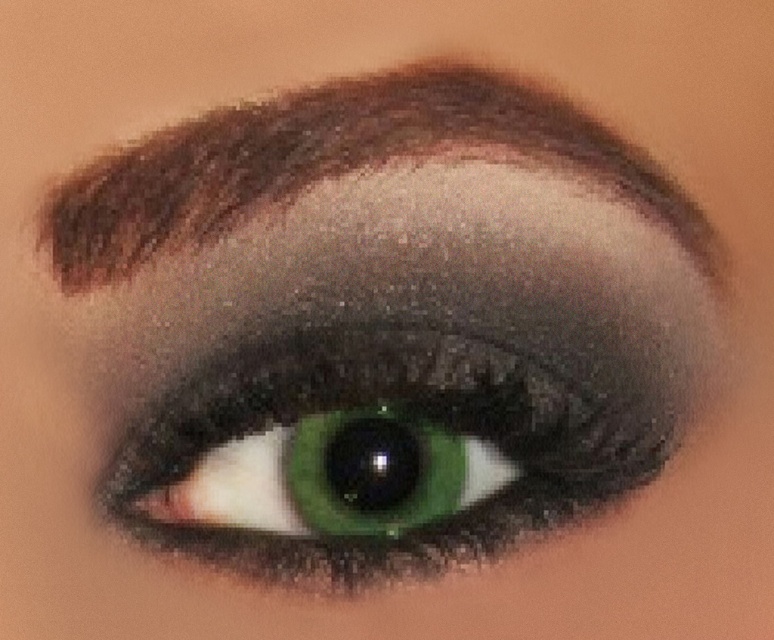
You are an artist analyzing a makeup look. You notice the shiny green eye at center and the smokey brown eyebrow at upper center. Which object is positioned to the left of the other?

The smokey brown eyebrow at upper center is positioned to the left of the shiny green eye at center.

You are a makeup artist trying to apply eyeliner. You have to decide whether to adjust the angle of your eyeliner brush based on the position of the shiny green eye at center and the smokey brown eyebrow at upper center. Which object is closer to you, requiring you to adjust your brush angle accordingly?

The shiny green eye at center is closer to you than the smokey brown eyebrow at upper center, so you should adjust your eyeliner brush angle to focus on the shiny green eye at center first.